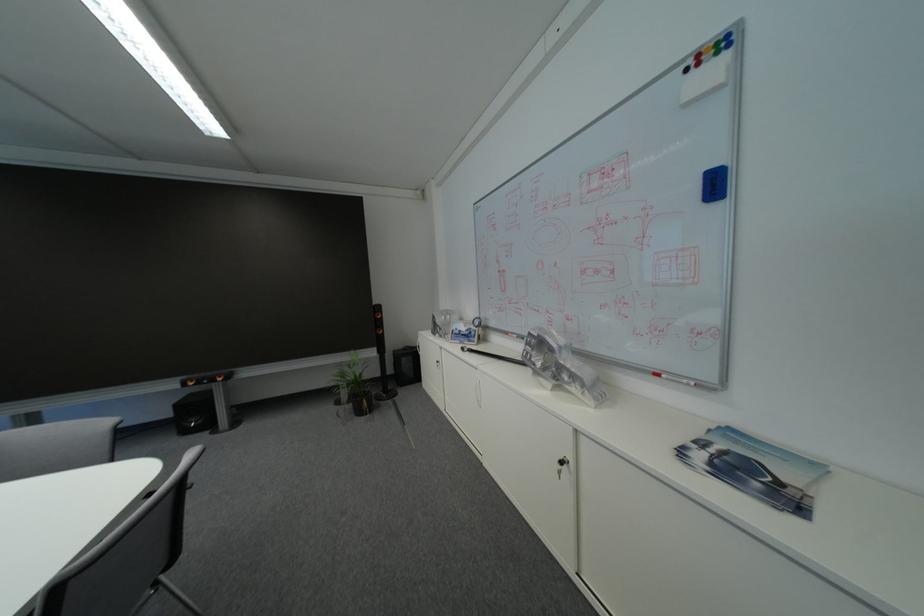
Where would you lift the small potted plant? Please return your answer as a coordinate pair (x, y).

(351, 387)